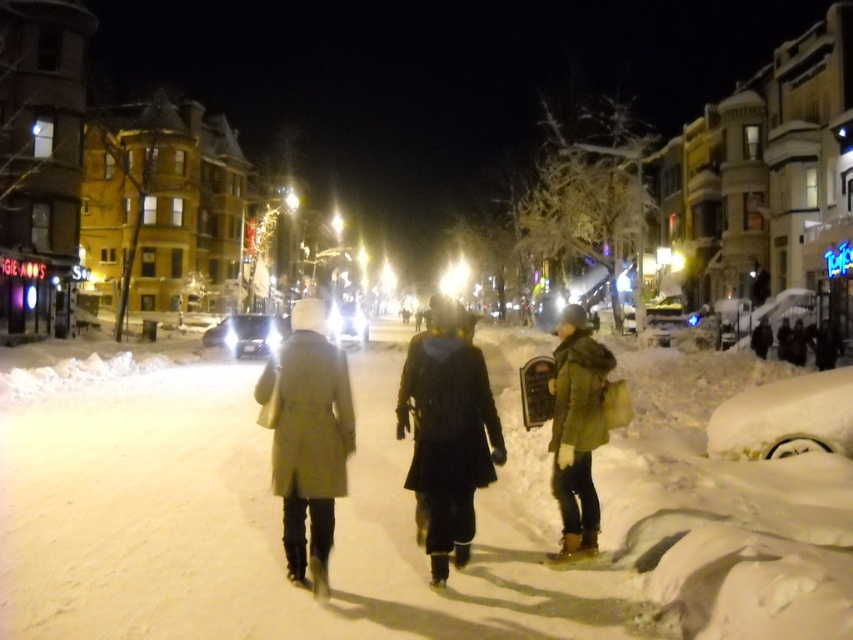
Is black matte coat at center positioned behind green matte coat at center?

That is False.

Who is lower down, black matte coat at center or green matte coat at center?

Positioned lower is black matte coat at center.

The width and height of the screenshot is (853, 640). What do you see at coordinates (447, 433) in the screenshot?
I see `black matte coat at center` at bounding box center [447, 433].

This screenshot has width=853, height=640. What are the coordinates of `black matte coat at center` in the screenshot? It's located at (447, 433).

Is light beige coat at center to the right of green matte coat at center from the viewer's perspective?

No, light beige coat at center is not to the right of green matte coat at center.

Between light beige coat at center and green matte coat at center, which one appears on the right side from the viewer's perspective?

From the viewer's perspective, green matte coat at center appears more on the right side.

Which is in front, point (302, 378) or point (566, 464)?

Point (302, 378)

The height and width of the screenshot is (640, 853). What are the coordinates of `light beige coat at center` in the screenshot? It's located at (306, 436).

Which is in front, point (445, 529) or point (294, 305)?

Point (445, 529) is in front.

Which is behind, point (461, 458) or point (329, 458)?

Point (461, 458)

Where is `black matte coat at center`? This screenshot has height=640, width=853. black matte coat at center is located at coordinates (x=447, y=433).